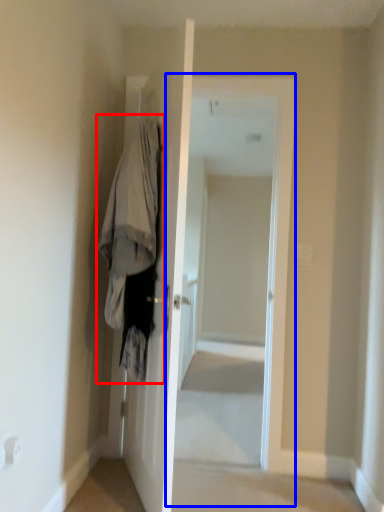
Question: Among these objects, which one is farthest to the camera, clothing (highlighted by a red box) or screen door (highlighted by a blue box)?

Choices:
 (A) clothing
 (B) screen door

Answer: (B)